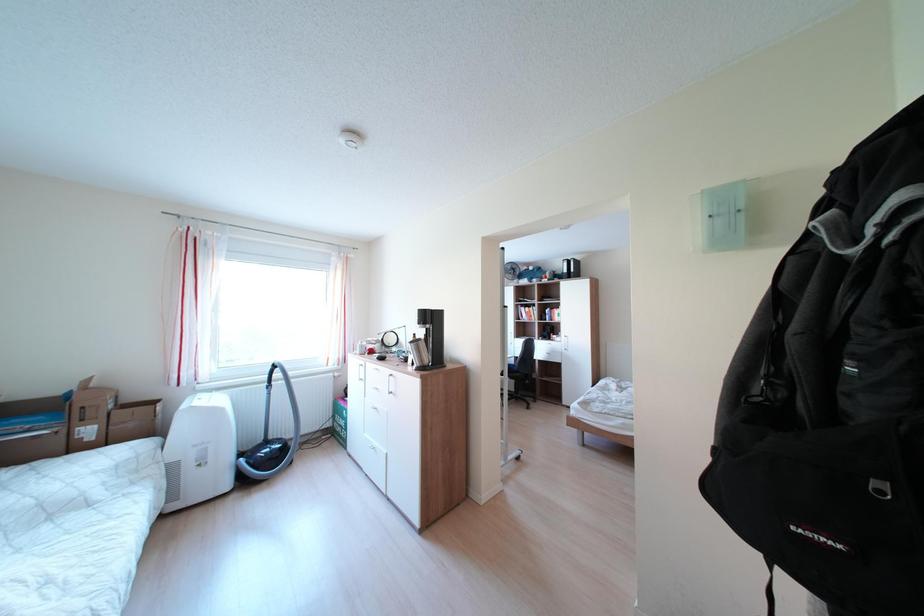
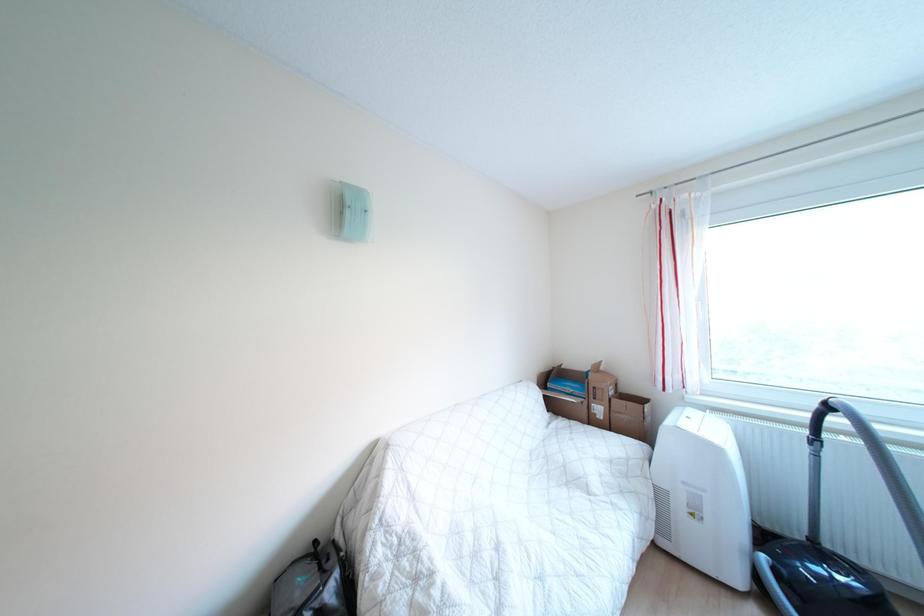
Question: The first image is from the beginning of the video and the second image is from the end. How did the camera likely rotate when shooting the video?

Choices:
 (A) Left
 (B) Right
 (C) Up
 (D) Down

Answer: (A)